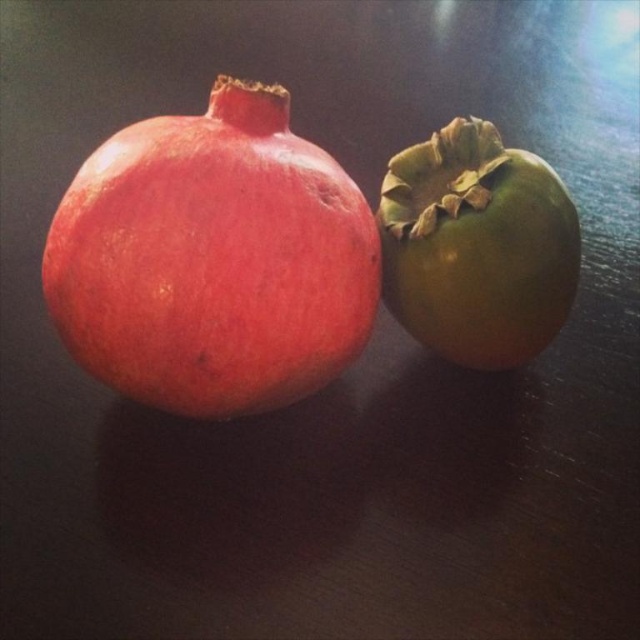
Is shiny red pomegranate at left to the right of green matte persimmon at right from the viewer's perspective?

No, shiny red pomegranate at left is not to the right of green matte persimmon at right.

Consider the image. Measure the distance between shiny red pomegranate at left and camera.

1.11 meters

Locate an element on the screen. shiny red pomegranate at left is located at coordinates pyautogui.click(x=212, y=259).